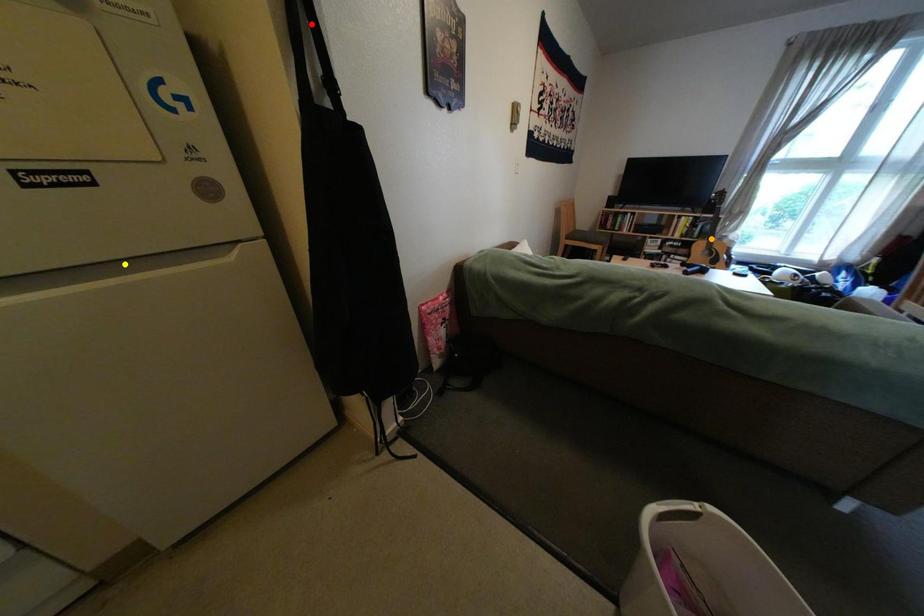
Order these from nearest to farthest:
1. orange point
2. red point
3. yellow point

1. orange point
2. yellow point
3. red point